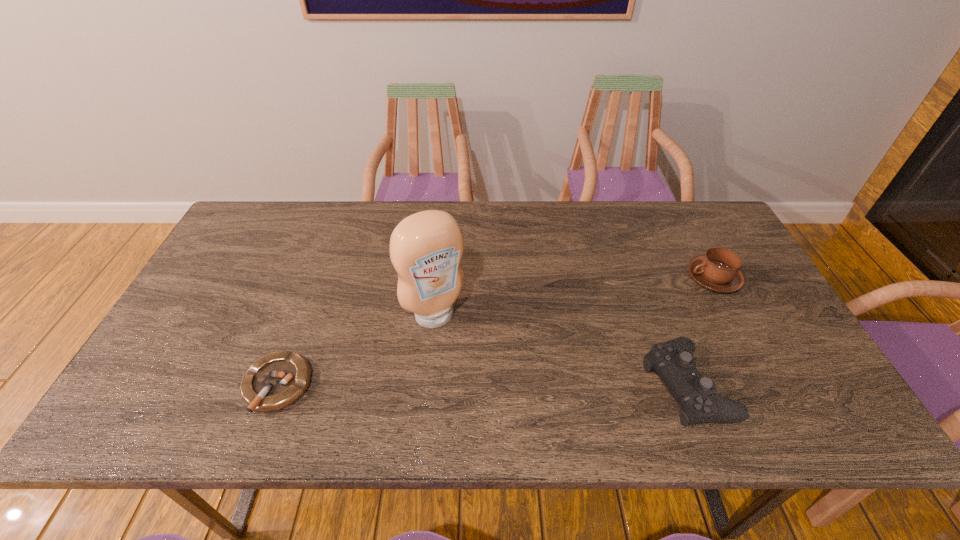
Identify the location of vacant space at the far right corner of the desktop. (696, 218).

What are the coordinates of `empty location between the rightmost object and the condiment` in the screenshot? It's located at (574, 297).

Locate an element on the screen. free spot between the cappuccino and the ashtray is located at coordinates (495, 332).

Locate an element on the screen. The width and height of the screenshot is (960, 540). free space between the rightmost object and the third object from right to left is located at coordinates (574, 297).

The image size is (960, 540). I want to click on empty space between the second object from left to right and the control, so click(561, 350).

This screenshot has height=540, width=960. In order to click on free space between the control and the ashtray in this screenshot , I will do [482, 385].

Locate an element on the screen. The image size is (960, 540). blank region between the ashtray and the third object from left to right is located at coordinates (482, 385).

You are a GUI agent. You are given a task and a screenshot of the screen. Output one action in this format:
    pyautogui.click(x=<x>, y=<y>)
    Task: Click on the vacant region between the second object from right to left and the cappuccino
    The image size is (960, 540).
    Given the screenshot: What is the action you would take?
    pyautogui.click(x=700, y=332)

The width and height of the screenshot is (960, 540). Identify the location of vacant space in between the second object from left to right and the second object from right to left. (561, 350).

Find the location of a particular element. The height and width of the screenshot is (540, 960). vacant space that's between the third object from right to left and the shortest object is located at coordinates (356, 350).